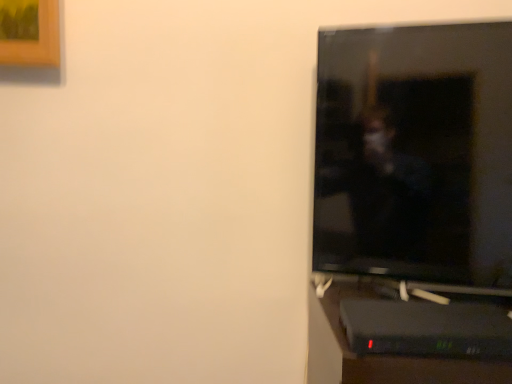
Identify the location of black glossy tv at right. Image resolution: width=512 pixels, height=384 pixels. (415, 153).

Describe the element at coordinates (415, 153) in the screenshot. I see `black glossy tv at right` at that location.

Measure the distance between point (378, 305) and camera.

The distance of point (378, 305) from camera is 28.46 inches.

This screenshot has height=384, width=512. What do you see at coordinates (426, 328) in the screenshot? I see `black plastic computer desk at lower right` at bounding box center [426, 328].

This screenshot has height=384, width=512. I want to click on black plastic computer desk at lower right, so click(426, 328).

What is the approximate width of black plastic computer desk at lower right?

black plastic computer desk at lower right is 6.84 inches wide.

Identify the location of black glossy tv at right. (415, 153).

From the picture: Which object is positioned more to the left, black glossy tv at right or black plastic computer desk at lower right?

From the viewer's perspective, black plastic computer desk at lower right appears more on the left side.

Considering the positions of objects black glossy tv at right and black plastic computer desk at lower right in the image provided, who is in front, black glossy tv at right or black plastic computer desk at lower right?

black plastic computer desk at lower right is more forward.

Is point (469, 165) positioned before point (379, 307)?

No, it is behind (379, 307).

From the image's perspective, is black glossy tv at right located beneath black plastic computer desk at lower right?

No, from the image's perspective, black glossy tv at right is not below black plastic computer desk at lower right.

From a real-world perspective, is black glossy tv at right on top of black plastic computer desk at lower right?

Indeed, from a real-world perspective, black glossy tv at right stands above black plastic computer desk at lower right.

Does black glossy tv at right have a greater width compared to black plastic computer desk at lower right?

→ No, black glossy tv at right is not wider than black plastic computer desk at lower right.

From their relative heights in the image, would you say black glossy tv at right is taller or shorter than black plastic computer desk at lower right?

In the image, black glossy tv at right appears to be taller than black plastic computer desk at lower right.

Which of these two, black glossy tv at right or black plastic computer desk at lower right, is smaller?

black plastic computer desk at lower right is smaller.

Looking at this image, can black plastic computer desk at lower right be found inside black glossy tv at right?

No, black plastic computer desk at lower right is located outside of black glossy tv at right.

Would you say black glossy tv at right is a long distance from black plastic computer desk at lower right?

No, black glossy tv at right is in close proximity to black plastic computer desk at lower right.

Is black glossy tv at right facing away from black plastic computer desk at lower right?

No, black glossy tv at right's orientation is not away from black plastic computer desk at lower right.

What's the angular difference between black glossy tv at right and black plastic computer desk at lower right's facing directions?

There is a 12.5-degree angle between the facing directions of black glossy tv at right and black plastic computer desk at lower right.

Measure the distance between black glossy tv at right and black plastic computer desk at lower right.

black glossy tv at right and black plastic computer desk at lower right are 11.57 inches apart.

At what (x,y) coordinates should I click in order to perform the action: click on television that appears above the black plastic computer desk at lower right (from the image's perspective). Please return your answer as a coordinate pair (x, y). The height and width of the screenshot is (384, 512). Looking at the image, I should click on (415, 153).

Between black plastic computer desk at lower right and black glossy tv at right, which one appears on the right side from the viewer's perspective?

From the viewer's perspective, black glossy tv at right appears more on the right side.

Which object is more forward, black plastic computer desk at lower right or black glossy tv at right?

black plastic computer desk at lower right is more forward.

Considering the points (503, 314) and (471, 281), which point is behind, point (503, 314) or point (471, 281)?

Positioned behind is point (471, 281).

From the image's perspective, does black plastic computer desk at lower right appear higher than black glossy tv at right?

No, from the image's perspective, black plastic computer desk at lower right is not above black glossy tv at right.

From a real-world perspective, does black plastic computer desk at lower right sit lower than black glossy tv at right?

Yes, from a real-world perspective, black plastic computer desk at lower right is under black glossy tv at right.

Can you confirm if black plastic computer desk at lower right is thinner than black glossy tv at right?

Incorrect, the width of black plastic computer desk at lower right is not less than that of black glossy tv at right.

Is black plastic computer desk at lower right shorter than black glossy tv at right?

Yes, black plastic computer desk at lower right is shorter than black glossy tv at right.

Which of these two, black plastic computer desk at lower right or black glossy tv at right, is bigger?

black glossy tv at right is bigger.

Is black plastic computer desk at lower right completely or partially outside of black glossy tv at right?

Yes, black plastic computer desk at lower right is located beyond the bounds of black glossy tv at right.

Is black plastic computer desk at lower right touching black glossy tv at right?

No, black plastic computer desk at lower right is not next to black glossy tv at right.

Is black plastic computer desk at lower right looking in the opposite direction of black glossy tv at right?

Absolutely, black plastic computer desk at lower right is directed away from black glossy tv at right.

In the scene shown: How different are the orientations of black plastic computer desk at lower right and black glossy tv at right in degrees?

The angle between the facing direction of black plastic computer desk at lower right and the facing direction of black glossy tv at right is 12.5 degrees.

Where is `television located on the right of black plastic computer desk at lower right`? This screenshot has width=512, height=384. television located on the right of black plastic computer desk at lower right is located at coordinates (415, 153).

At what (x,y) coordinates should I click in order to perform the action: click on computer desk that appears on the left of black glossy tv at right. Please return your answer as a coordinate pair (x, y). The width and height of the screenshot is (512, 384). Looking at the image, I should click on (426, 328).

Find the location of a particular element. The image size is (512, 384). computer desk below the black glossy tv at right (from the image's perspective) is located at coordinates (426, 328).